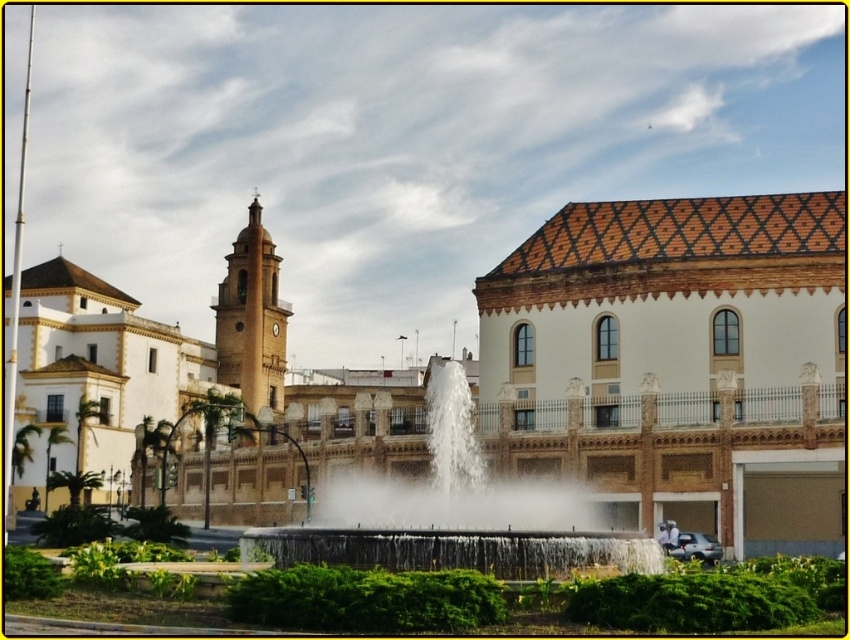
You are standing in the urban scene and want to determine the relative positions of two points marked in the image. Which point is closer to you, point (842, 344) or point (839, 465)?

Point (842, 344) is further to the viewer than point (839, 465). Therefore, point (839, 465) is closer to you.

You are standing at the center of the fountain and want to head towards the terracotta tiled palace at right. Which direction should you walk relative to the bell tower on the left?

The terracotta tiled palace at right is located to the right of the bell tower on the left, so you should walk in the direction of the right side relative to the bell tower on the left.